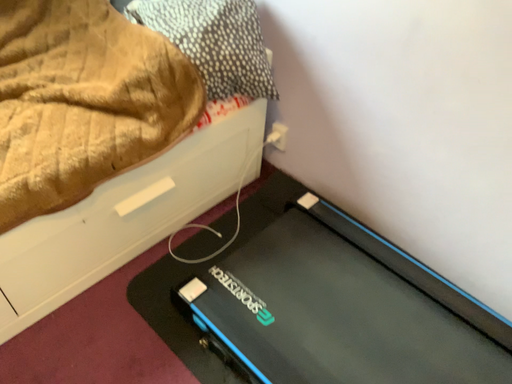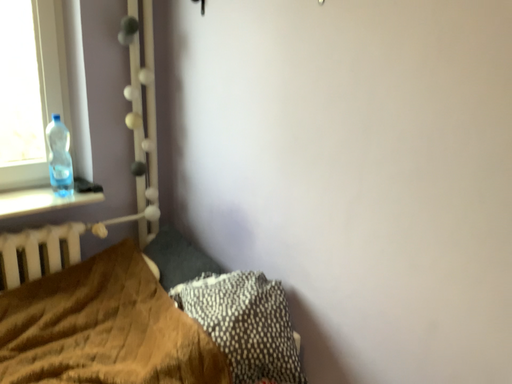
Question: How did the camera likely rotate when shooting the video?

Choices:
 (A) rotated downward
 (B) rotated upward

Answer: (B)